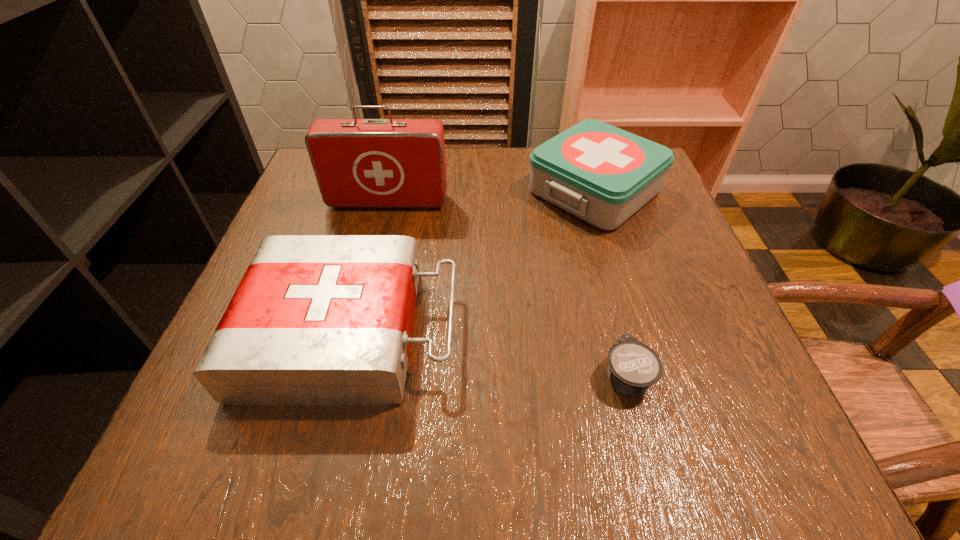
This screenshot has height=540, width=960. I want to click on the tallest object, so click(359, 163).

The width and height of the screenshot is (960, 540). What are the coordinates of `the rightmost first-aid kit` in the screenshot? It's located at (602, 174).

Find the location of a particular element. This screenshot has width=960, height=540. the nearest first-aid kit is located at coordinates [x=317, y=319].

Where is `yogurt`? yogurt is located at coordinates (633, 367).

Identify the location of blank area located 0.390m on the side of the tallest object with the first aid cross symbol. The width and height of the screenshot is (960, 540). (350, 357).

Find the location of a particular element. free location located 0.280m on the front of the rightmost first-aid kit is located at coordinates (641, 344).

Identify the location of free space located on the front side of the nearest first-aid kit. The width and height of the screenshot is (960, 540). (485, 331).

Where is `vacant space located on the left of the yogurt`? The image size is (960, 540). vacant space located on the left of the yogurt is located at coordinates (493, 375).

Where is `the first-aid kit that is at the right edge`? the first-aid kit that is at the right edge is located at coordinates (602, 174).

Locate an element on the screen. This screenshot has height=540, width=960. yogurt situated at the right edge is located at coordinates (633, 367).